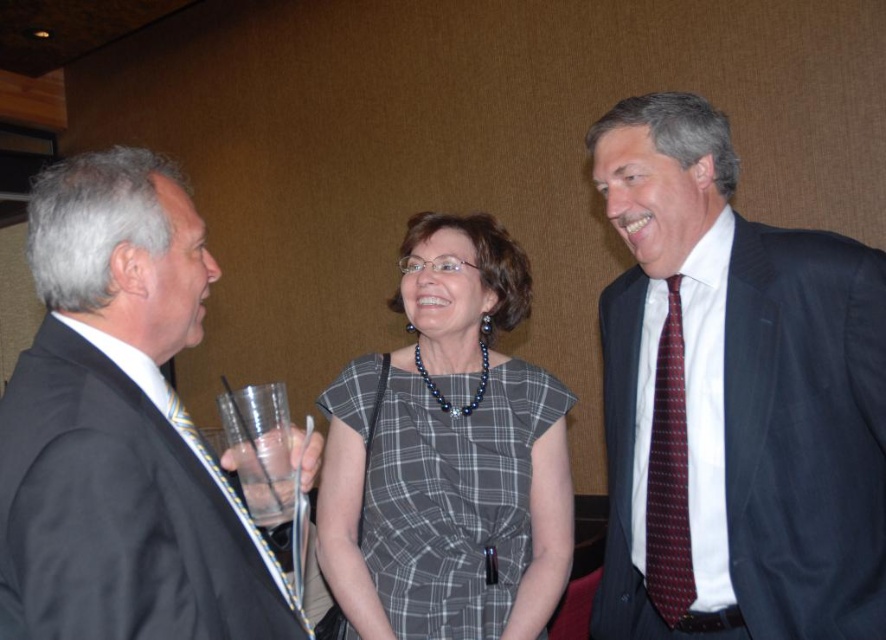
Question: Observing the image, what is the correct spatial positioning of maroon dotted tie at right in reference to clear plastic cup at center?

Choices:
 (A) below
 (B) above

Answer: (B)

Question: Among these points, which one is nearest to the camera?

Choices:
 (A) (825, 336)
 (B) (284, 499)

Answer: (B)

Question: Does plaid fabric dress at center appear over clear plastic cup at center?

Choices:
 (A) yes
 (B) no

Answer: (A)

Question: Estimate the real-world distances between objects in this image. Which object is farther from the clear plastic cup at center?

Choices:
 (A) maroon dotted tie at right
 (B) plaid fabric dress at center

Answer: (A)

Question: Which is nearer to the matte black suit at left?

Choices:
 (A) plaid fabric dress at center
 (B) clear plastic cup at center

Answer: (B)

Question: Does dark blue suit at right have a smaller size compared to clear plastic cup at center?

Choices:
 (A) no
 (B) yes

Answer: (A)